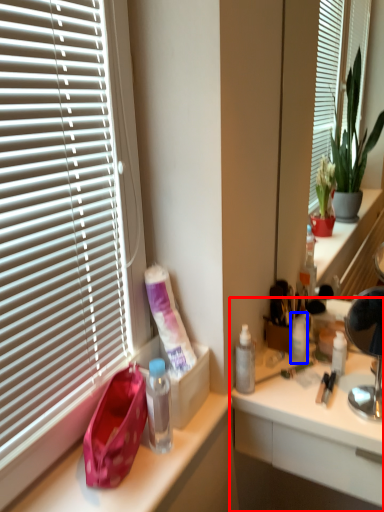
Question: Among these objects, which one is farthest to the camera, desk (highlighted by a red box) or toiletry (highlighted by a blue box)?

Choices:
 (A) desk
 (B) toiletry

Answer: (B)